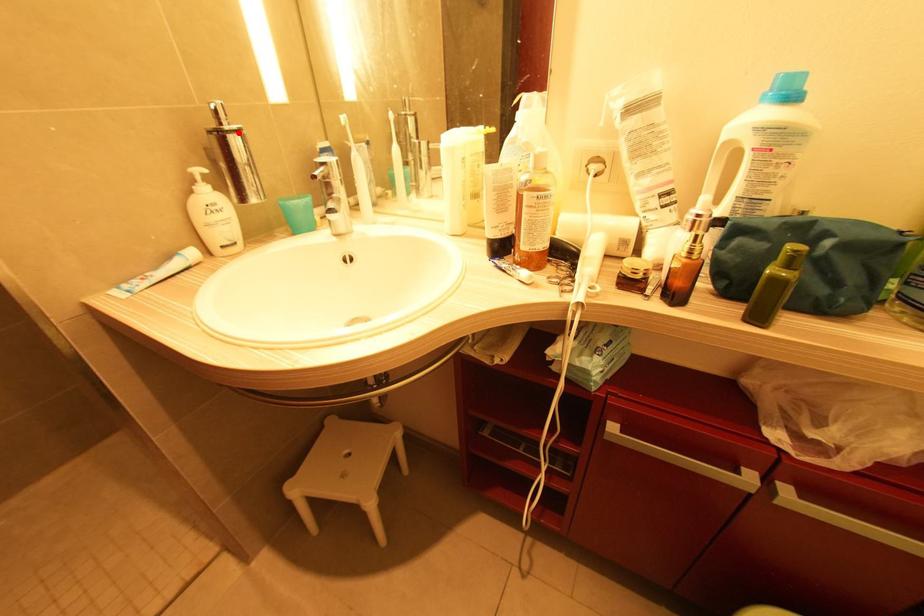
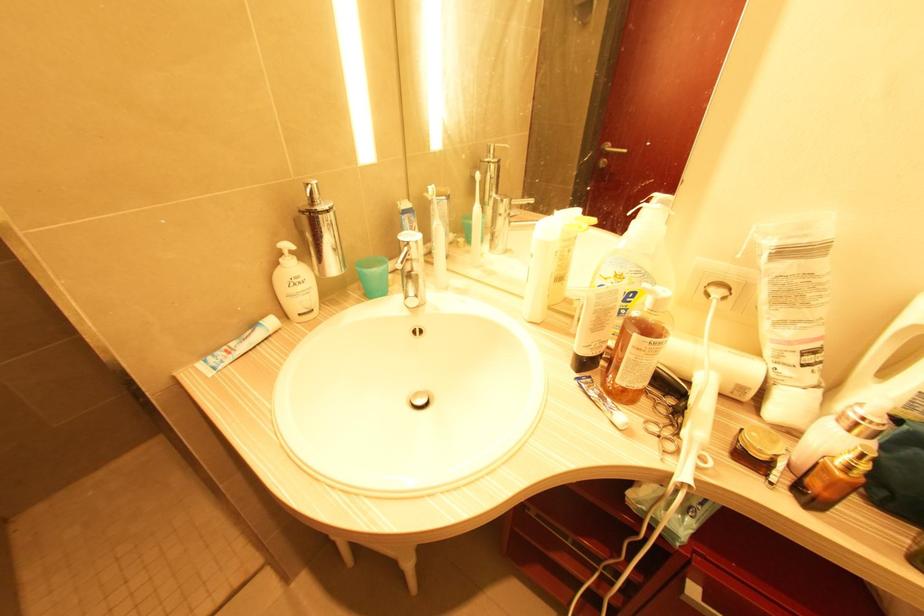
Where in the second image is the point corresponding to the highlighted location from the first image?

(329, 212)